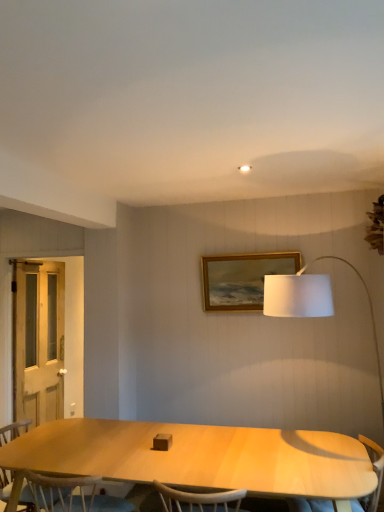
Question: Is gold wooden picture frame at upper center taller than white wooden screen door at left?

Choices:
 (A) yes
 (B) no

Answer: (B)

Question: From a real-world perspective, is gold wooden picture frame at upper center on white wooden screen door at left?

Choices:
 (A) no
 (B) yes

Answer: (B)

Question: Is gold wooden picture frame at upper center facing away from white wooden screen door at left?

Choices:
 (A) no
 (B) yes

Answer: (A)

Question: Does gold wooden picture frame at upper center have a lesser height compared to white wooden screen door at left?

Choices:
 (A) no
 (B) yes

Answer: (B)

Question: Can you confirm if gold wooden picture frame at upper center is positioned to the left of white wooden screen door at left?

Choices:
 (A) no
 (B) yes

Answer: (A)

Question: Looking at their shapes, would you say white wooden screen door at left is wider or thinner than light brown wood chair at lower left?

Choices:
 (A) thin
 (B) wide

Answer: (A)

Question: In terms of size, does white wooden screen door at left appear bigger or smaller than light brown wood chair at lower left?

Choices:
 (A) big
 (B) small

Answer: (B)

Question: Considering the positions of white wooden screen door at left and light brown wood chair at lower left in the image, is white wooden screen door at left taller or shorter than light brown wood chair at lower left?

Choices:
 (A) short
 (B) tall

Answer: (B)

Question: From the image's perspective, is white wooden screen door at left above or below light brown wood chair at lower left?

Choices:
 (A) above
 (B) below

Answer: (A)

Question: From a real-world perspective, is gold wooden picture frame at upper center above or below white wooden screen door at left?

Choices:
 (A) below
 (B) above

Answer: (B)

Question: Based on their positions, is gold wooden picture frame at upper center located to the left or right of white wooden screen door at left?

Choices:
 (A) left
 (B) right

Answer: (B)

Question: Is gold wooden picture frame at upper center taller or shorter than white wooden screen door at left?

Choices:
 (A) short
 (B) tall

Answer: (A)

Question: Considering their positions, is gold wooden picture frame at upper center located in front of or behind white wooden screen door at left?

Choices:
 (A) front
 (B) behind

Answer: (A)

Question: Considering the positions of white wooden screen door at left and light wood armchair at lower right in the image, is white wooden screen door at left bigger or smaller than light wood armchair at lower right?

Choices:
 (A) big
 (B) small

Answer: (B)

Question: Considering the positions of white wooden screen door at left and light wood armchair at lower right in the image, is white wooden screen door at left wider or thinner than light wood armchair at lower right?

Choices:
 (A) wide
 (B) thin

Answer: (B)